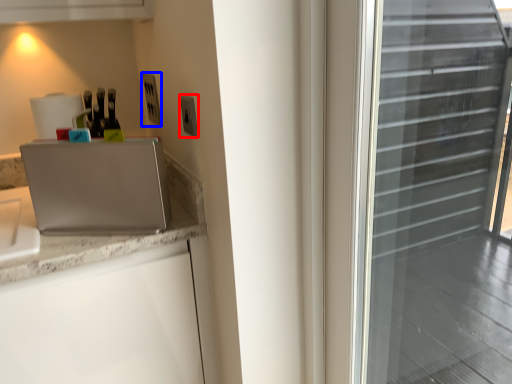
Question: Which point is closer to the camera, electric outlet (highlighted by a red box) or electric outlet (highlighted by a blue box)?

Choices:
 (A) electric outlet
 (B) electric outlet

Answer: (A)